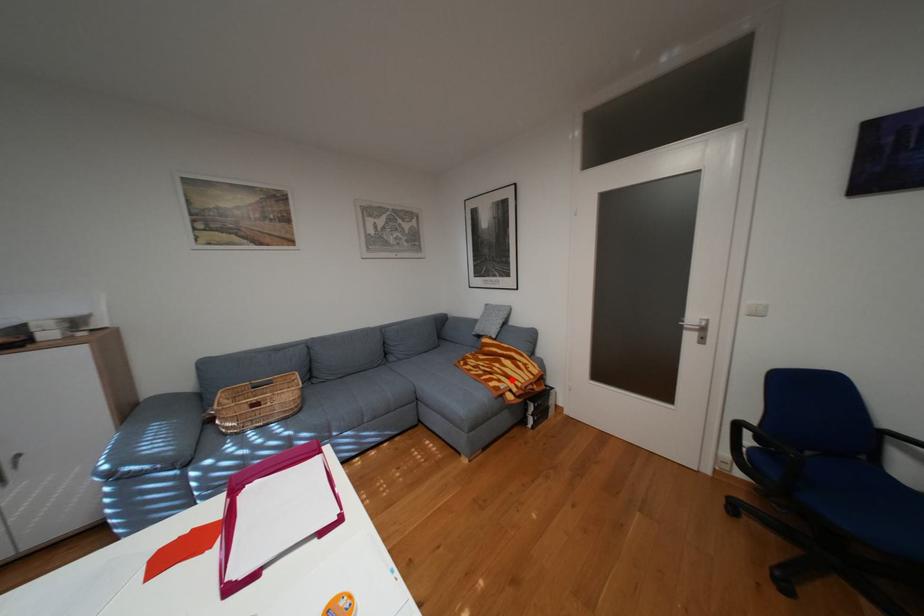
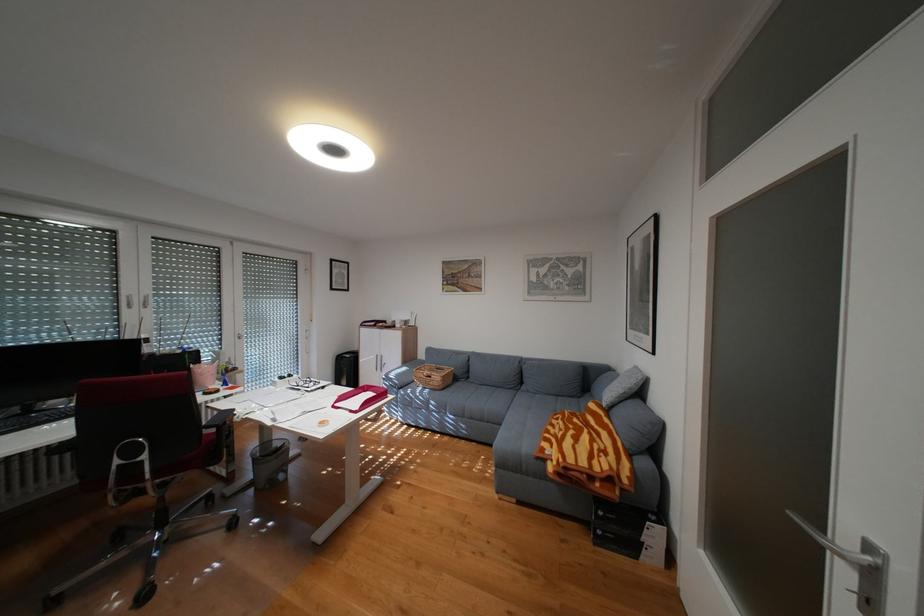
Question: I am providing you with two images of the same scene from different viewpoints. A red point is shown in image1. For the corresponding object point in image2, is it positioned nearer or farther from the camera?

Choices:
 (A) Nearer
 (B) Farther

Answer: (A)